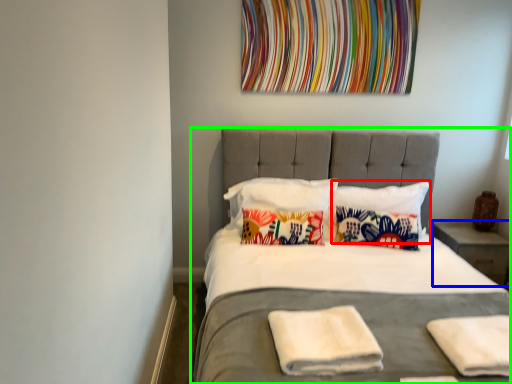
Question: Based on their relative distances, which object is farther from pillow (highlighted by a red box)? Choose from nightstand (highlighted by a blue box) and bed (highlighted by a green box).

Choices:
 (A) nightstand
 (B) bed

Answer: (B)